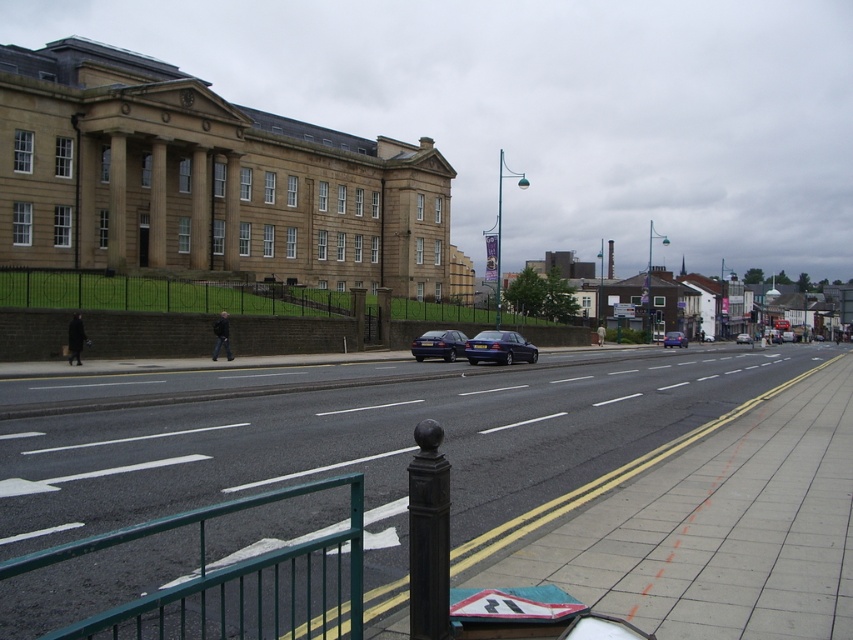
Between point (283, 419) and point (534, 600), which one is positioned behind?

Point (283, 419)

Is the position of smooth concrete pavement at center more distant than that of reflective plastic sign at lower center?

No, it is not.

Find the location of a particular element. The width and height of the screenshot is (853, 640). smooth concrete pavement at center is located at coordinates (401, 451).

Who is higher up, smooth concrete pavement at center or metallic streetlight at upper center?

metallic streetlight at upper center is above.

Is smooth concrete pavement at center behind metallic streetlight at upper center?

No, it is not.

Describe the element at coordinates (401, 451) in the screenshot. I see `smooth concrete pavement at center` at that location.

This screenshot has width=853, height=640. I want to click on smooth concrete pavement at center, so click(x=401, y=451).

Who is lower down, reflective plastic sign at lower center or satin blue sedan at center?

reflective plastic sign at lower center is below.

Is reflective plastic sign at lower center behind satin blue sedan at center?

No.

Is point (541, 609) closer to viewer compared to point (486, 356)?

Yes, point (541, 609) is in front of point (486, 356).

Find the location of `reflective plastic sign at lower center`. reflective plastic sign at lower center is located at coordinates 514,604.